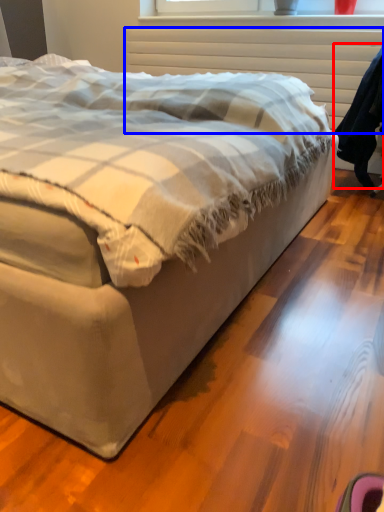
Question: Which point is further to the camera, robe (highlighted by a red box) or radiator (highlighted by a blue box)?

Choices:
 (A) robe
 (B) radiator

Answer: (B)